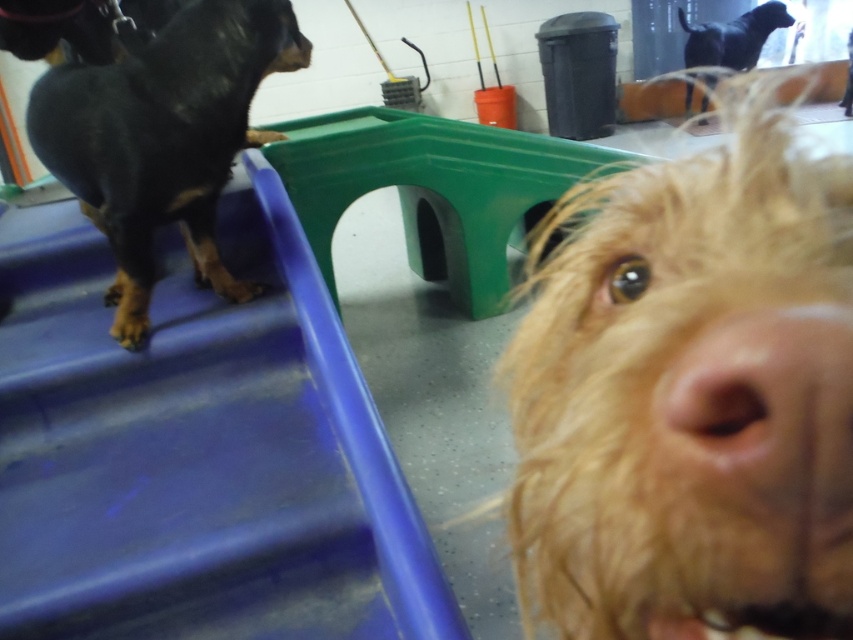
Question: Does wet golden fur at center have a greater width compared to black smooth dog at left?

Choices:
 (A) no
 (B) yes

Answer: (A)

Question: Which is farther from the black glossy statue at upper right?

Choices:
 (A) black smooth dog at left
 (B) wet golden fur at center

Answer: (B)

Question: Which of the following is the closest to the observer?

Choices:
 (A) (219, 164)
 (B) (552, 573)
 (C) (700, 124)

Answer: (B)

Question: Is wet golden fur at center smaller than black glossy statue at upper right?

Choices:
 (A) yes
 (B) no

Answer: (A)

Question: Can you confirm if black smooth dog at left is positioned to the right of black glossy statue at upper right?

Choices:
 (A) no
 (B) yes

Answer: (A)

Question: Which point appears closest to the camera in this image?

Choices:
 (A) (705, 28)
 (B) (294, 33)
 (C) (642, 493)

Answer: (C)